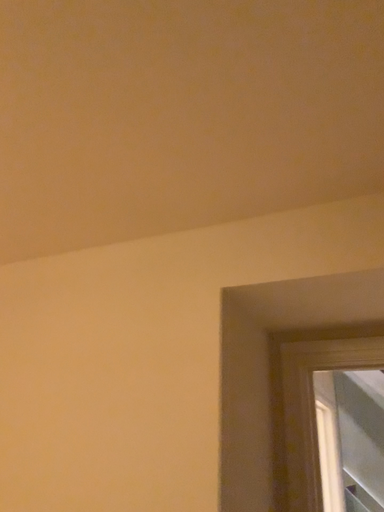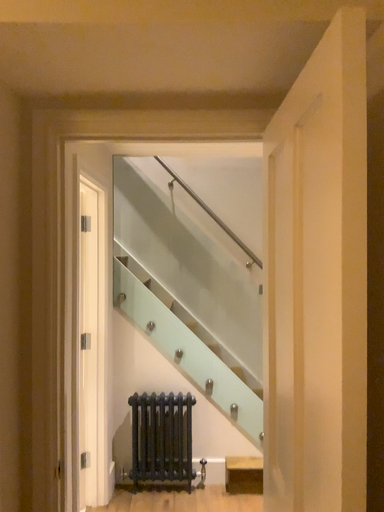
Question: Which way did the camera rotate in the video?

Choices:
 (A) rotated right
 (B) rotated left

Answer: (A)